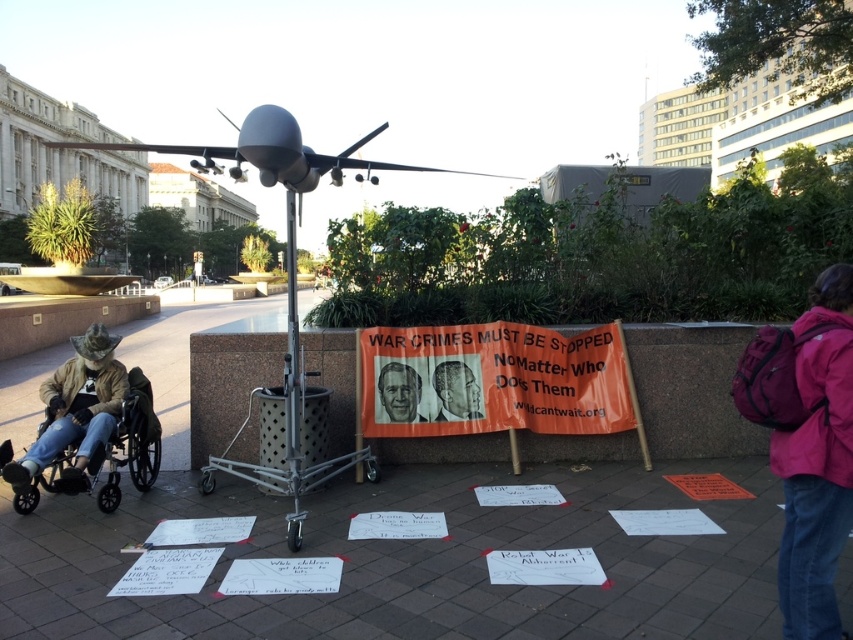
Between concrete pavement at center and black matte portrait at center, which one is positioned higher?

black matte portrait at center is higher up.

Is point (71, 508) positioned after point (461, 401)?

No, it is in front of (461, 401).

Does point (698, 404) come farther from viewer compared to point (460, 374)?

Yes, it is behind point (460, 374).

Locate an element on the screen. concrete pavement at center is located at coordinates (402, 540).

Between pink fabric backpack at lower right and smooth plastic poster at center, which one has less height?

Standing shorter between the two is smooth plastic poster at center.

Does pink fabric backpack at lower right appear on the right side of smooth plastic poster at center?

Indeed, pink fabric backpack at lower right is positioned on the right side of smooth plastic poster at center.

Who is more forward, [838,275] or [416,417]?

Point [838,275] is more forward.

What are the coordinates of `pink fabric backpack at lower right` in the screenshot? It's located at (817, 464).

In order to click on concrete pavement at center in this screenshot , I will do `click(402, 540)`.

Consider the image. Can you confirm if concrete pavement at center is wider than smooth plastic poster at center?

Yes.

Is point (660, 470) less distant than point (426, 420)?

That is True.

Find the location of a particular element. concrete pavement at center is located at coordinates (402, 540).